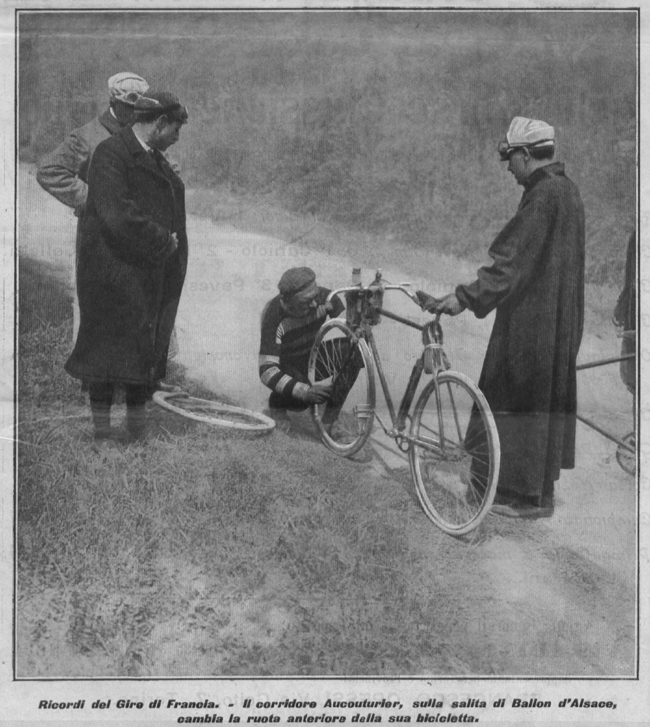
Where is `seat`? This screenshot has height=727, width=650. seat is located at coordinates (432, 297).